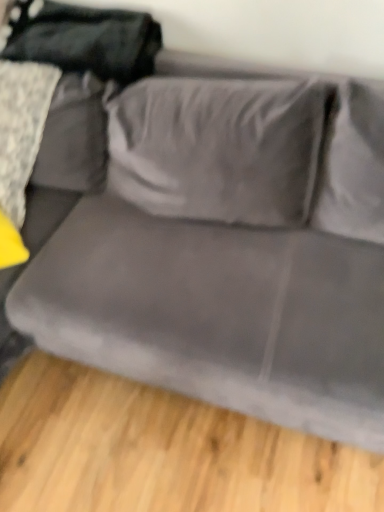
Find the location of a particular element. Image resolution: width=384 pixels, height=512 pixels. gray fabric couch at lower center is located at coordinates (160, 450).

The width and height of the screenshot is (384, 512). Describe the element at coordinates (160, 450) in the screenshot. I see `gray fabric couch at lower center` at that location.

Identify the location of gray fabric couch at lower center. The image size is (384, 512). (160, 450).